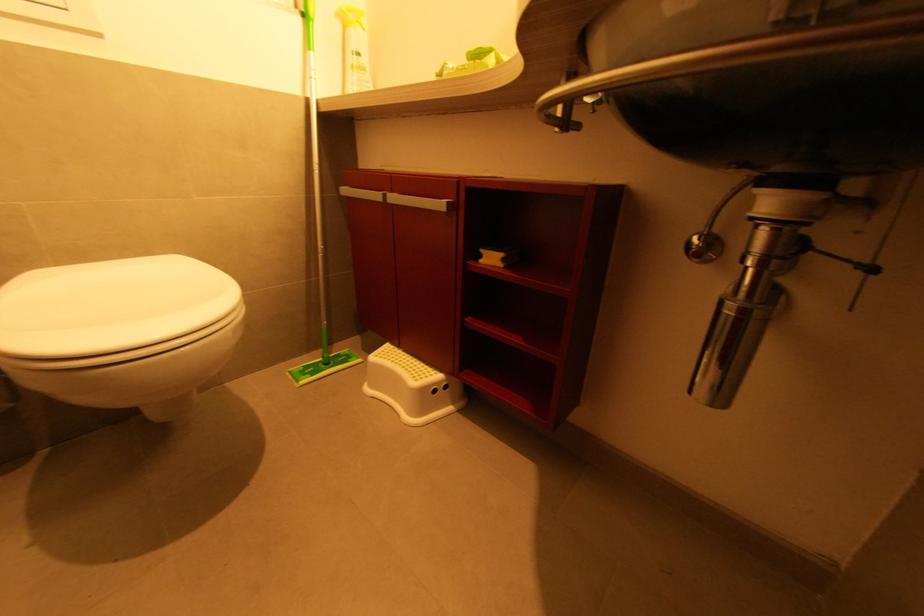
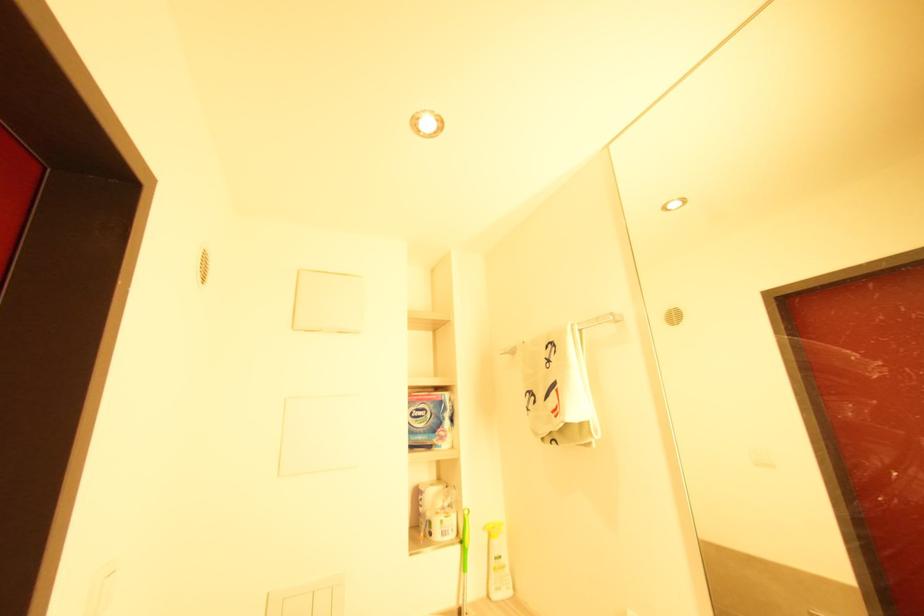
The images are taken continuously from a first-person perspective. In which direction is your viewpoint rotating?

The camera rotated toward left-up.